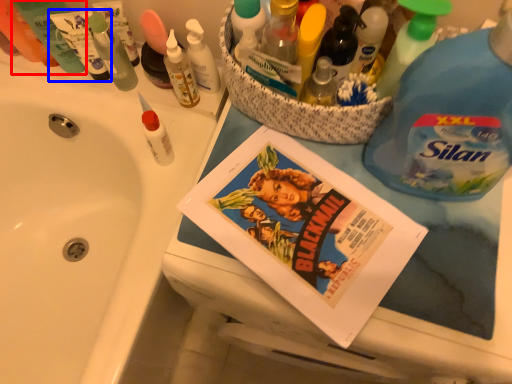
Question: Which object is further to the camera taking this photo, toiletry (highlighted by a red box) or toiletry (highlighted by a blue box)?

Choices:
 (A) toiletry
 (B) toiletry

Answer: (B)